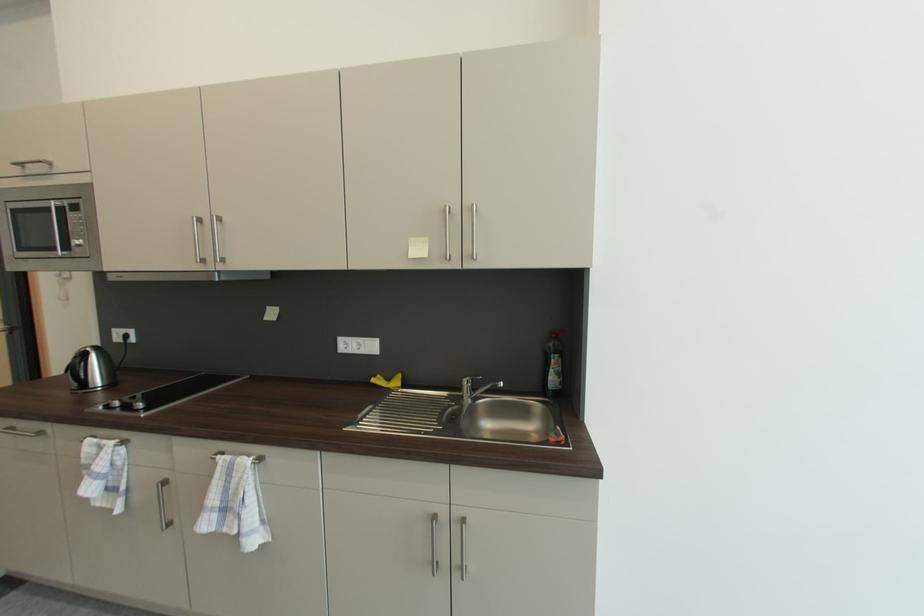
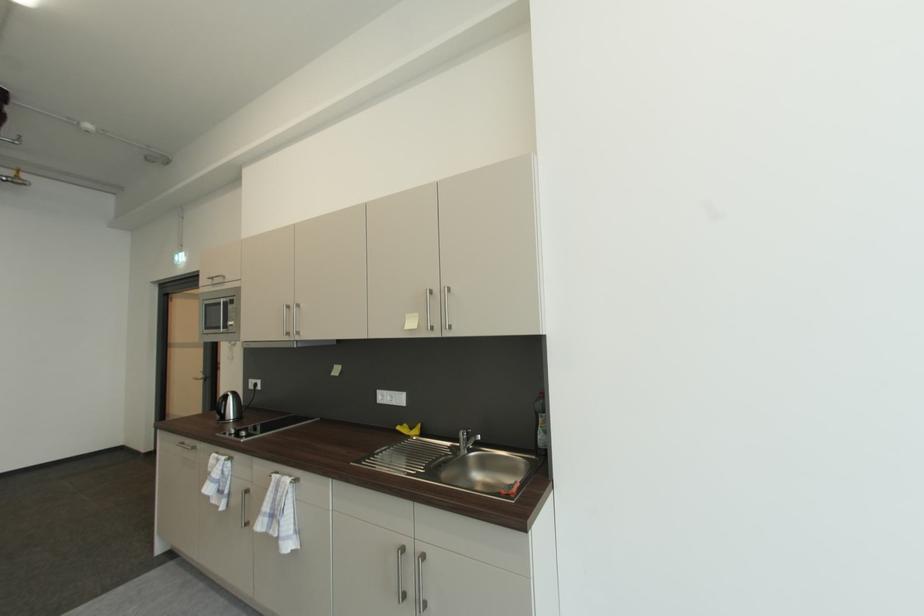
Find the pixel in the second image that matches pixel 89 463 in the first image.

(215, 471)